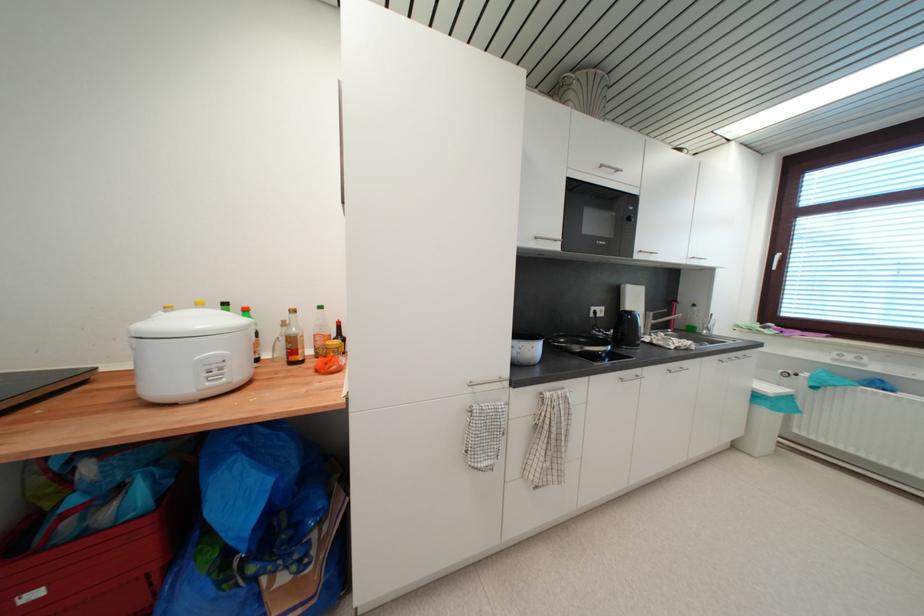
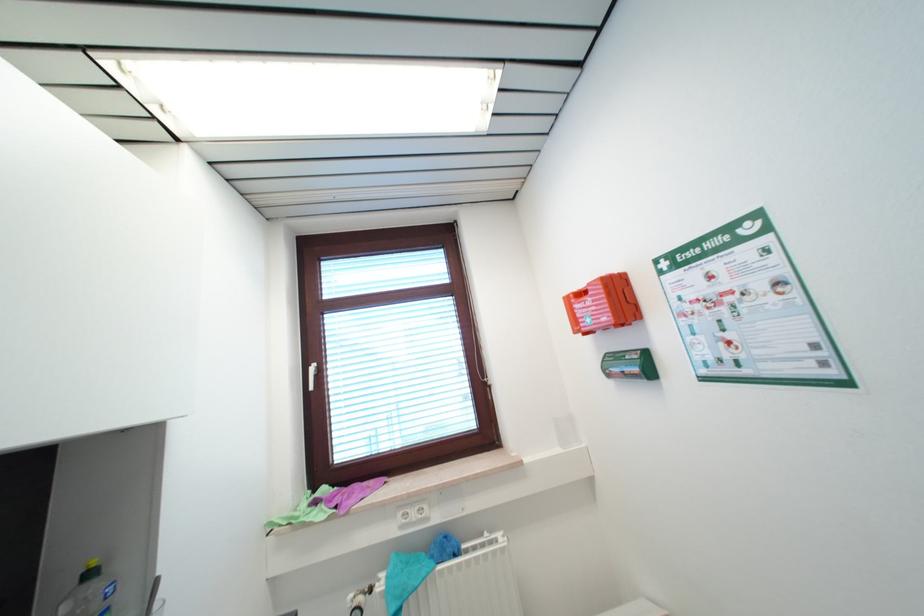
In the second image, find the point that corresponds to point 761,328 in the first image.

(311, 501)